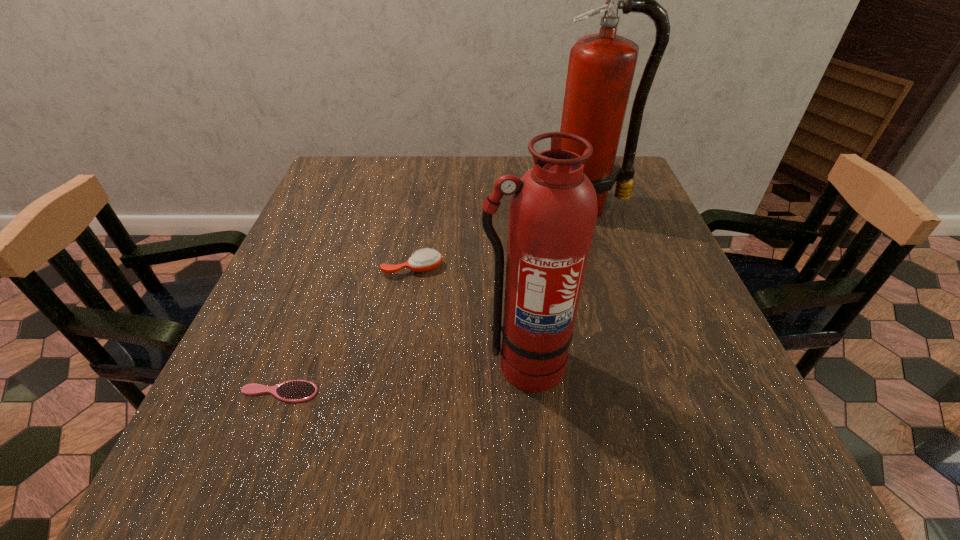
Where is `free space at the near left corner of the desktop`? The height and width of the screenshot is (540, 960). free space at the near left corner of the desktop is located at coordinates (219, 443).

This screenshot has height=540, width=960. Find the location of `empty space between the right hairbrush and the shorter hairbrush`. empty space between the right hairbrush and the shorter hairbrush is located at coordinates (346, 330).

At what (x,y) coordinates should I click in order to perform the action: click on free space that is in between the rightmost object and the right hairbrush. Please return your answer as a coordinate pair (x, y). This screenshot has width=960, height=540. Looking at the image, I should click on (500, 237).

At what (x,y) coordinates should I click in order to perform the action: click on unoccupied position between the shortest object and the left fire extinguisher. Please return your answer as a coordinate pair (x, y). Looking at the image, I should click on (401, 378).

You are a GUI agent. You are given a task and a screenshot of the screen. Output one action in this format:
    pyautogui.click(x=<x>, y=<y>)
    Task: Click on the empty space that is in between the tallest object and the second object from left to right
    
    Given the screenshot: What is the action you would take?
    pyautogui.click(x=500, y=237)

The image size is (960, 540). Find the location of `free space between the left fire extinguisher and the second shortest object`. free space between the left fire extinguisher and the second shortest object is located at coordinates (468, 316).

I want to click on vacant space in between the shortest object and the nearer fire extinguisher, so tap(401, 378).

The height and width of the screenshot is (540, 960). Identify the location of free spot between the rightmost object and the nearer hairbrush. (433, 299).

Locate an element on the screen. The image size is (960, 540). vacant space that is in between the farther hairbrush and the right fire extinguisher is located at coordinates (x=500, y=237).

Where is `vacant space that is in between the tallest object and the farther hairbrush`? The height and width of the screenshot is (540, 960). vacant space that is in between the tallest object and the farther hairbrush is located at coordinates (500, 237).